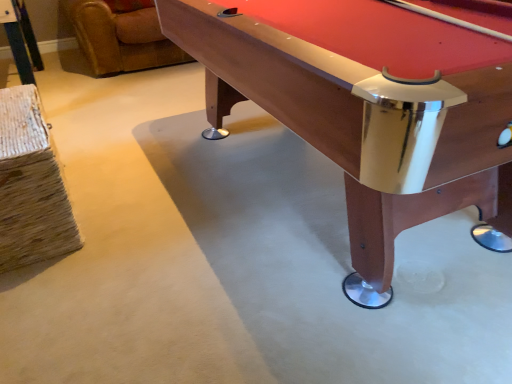
Question: Looking at their shapes, would you say wooden pool table at center is wider or thinner than brown leather swivel chair at upper left?

Choices:
 (A) wide
 (B) thin

Answer: (B)

Question: Does point (249, 9) appear closer or farther from the camera than point (106, 31)?

Choices:
 (A) farther
 (B) closer

Answer: (B)

Question: Based on their sizes in the image, would you say wooden pool table at center is bigger or smaller than brown leather swivel chair at upper left?

Choices:
 (A) big
 (B) small

Answer: (A)

Question: From a real-world perspective, is brown leather swivel chair at upper left above or below wooden pool table at center?

Choices:
 (A) above
 (B) below

Answer: (B)

Question: From the image's perspective, is brown leather swivel chair at upper left above or below wooden pool table at center?

Choices:
 (A) above
 (B) below

Answer: (A)

Question: Relative to wooden pool table at center, is brown leather swivel chair at upper left in front or behind?

Choices:
 (A) front
 (B) behind

Answer: (B)

Question: Is brown leather swivel chair at upper left to the left or to the right of wooden pool table at center in the image?

Choices:
 (A) left
 (B) right

Answer: (A)